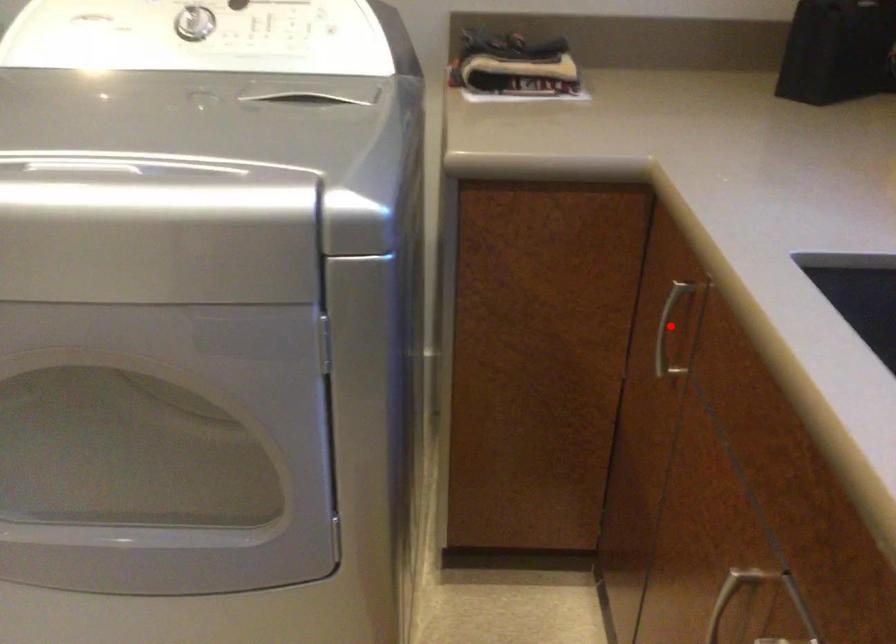
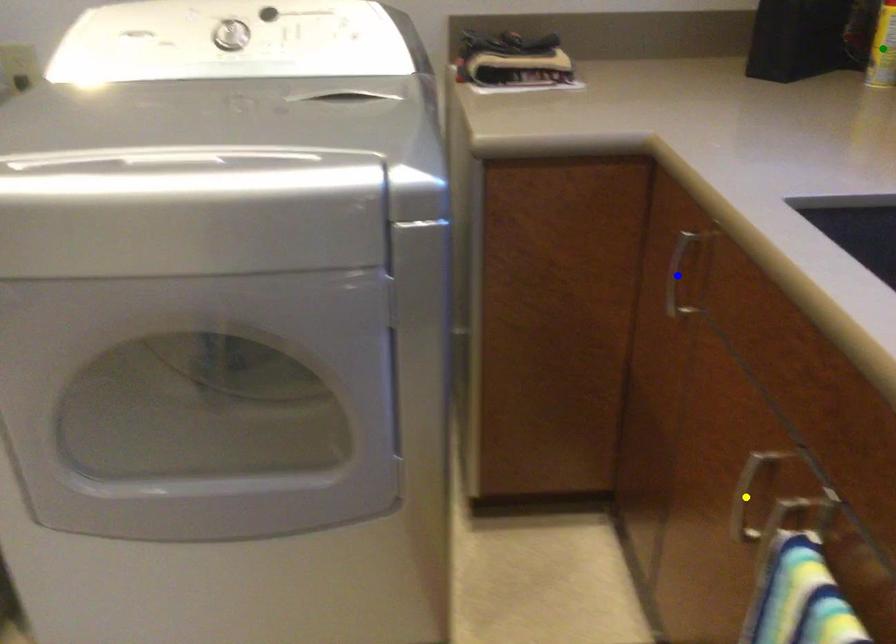
Question: I am providing you with two images of the same scene from different viewpoints. A red point is marked on the first image. You are given multiple points on the second image. Can you choose the point in image 2 that corresponds to the point in image 1?

Choices:
 (A) blue point
 (B) green point
 (C) yellow point

Answer: (A)